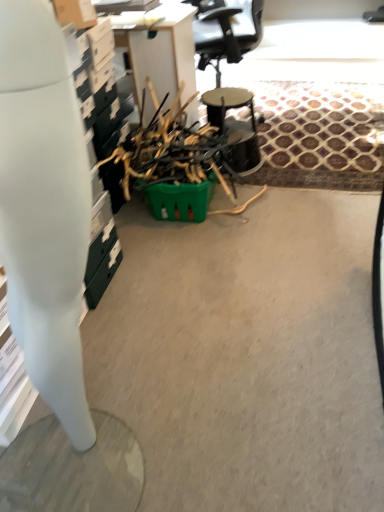
Question: Could you tell me if metallic black drum at center is turned towards green plastic basket at center?

Choices:
 (A) no
 (B) yes

Answer: (A)

Question: Is metallic black drum at center further to camera compared to green plastic basket at center?

Choices:
 (A) no
 (B) yes

Answer: (B)

Question: Does metallic black drum at center lie in front of green plastic basket at center?

Choices:
 (A) no
 (B) yes

Answer: (A)

Question: Is green plastic basket at center inside metallic black drum at center?

Choices:
 (A) no
 (B) yes

Answer: (A)

Question: Considering the relative sizes of metallic black drum at center and green plastic basket at center in the image provided, is metallic black drum at center bigger than green plastic basket at center?

Choices:
 (A) no
 (B) yes

Answer: (A)

Question: Based on their sizes in the image, would you say white glossy desk at left is bigger or smaller than metallic black drum at center?

Choices:
 (A) big
 (B) small

Answer: (A)

Question: Considering the positions of point (66, 373) and point (203, 103), is point (66, 373) closer or farther from the camera than point (203, 103)?

Choices:
 (A) closer
 (B) farther

Answer: (A)

Question: From the image's perspective, is white glossy desk at left positioned above or below metallic black drum at center?

Choices:
 (A) above
 (B) below

Answer: (B)

Question: Considering their positions, is white glossy desk at left located in front of or behind metallic black drum at center?

Choices:
 (A) behind
 (B) front

Answer: (B)

Question: Do you think green plastic basket at center is within metallic black drum at center, or outside of it?

Choices:
 (A) inside
 (B) outside

Answer: (B)

Question: Visually, is green plastic basket at center positioned to the left or to the right of metallic black drum at center?

Choices:
 (A) left
 (B) right

Answer: (A)

Question: Is green plastic basket at center bigger or smaller than metallic black drum at center?

Choices:
 (A) small
 (B) big

Answer: (B)

Question: In terms of height, does green plastic basket at center look taller or shorter compared to metallic black drum at center?

Choices:
 (A) short
 (B) tall

Answer: (B)

Question: Considering their positions, is green plastic basket at center located in front of or behind white glossy desk at left?

Choices:
 (A) front
 (B) behind

Answer: (B)

Question: Is green plastic basket at center wider or thinner than white glossy desk at left?

Choices:
 (A) thin
 (B) wide

Answer: (B)